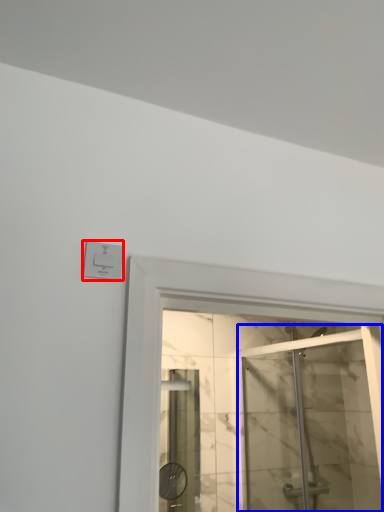
Question: Among these objects, which one is nearest to the camera, electric outlet (highlighted by a red box) or screen door (highlighted by a blue box)?

Choices:
 (A) electric outlet
 (B) screen door

Answer: (A)